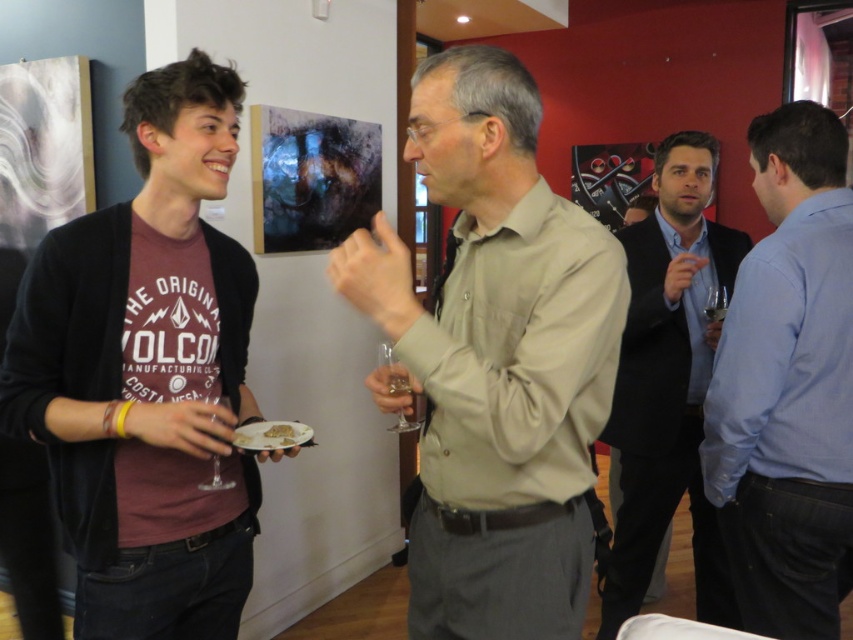
You are at an art exhibition and see two men in the foreground. One is wearing a matte khaki shirt at center and the other a blue shirt at right. Which man is shorter?

The matte khaki shirt at center is not as tall as blue shirt at right, so the man wearing the matte khaki shirt at center is shorter.

You are a photographer at the event and want to take a photo of the smooth black suit at right. Your camera has a minimum focus distance of 1.8 meters. Can you capture a clear photo without moving closer?

The smooth black suit at right is 2.03 meters away from the viewer, which is beyond the camera minimum focus distance of 1.8 meters. Therefore, you can capture a clear photo without moving closer.

You are at the art exhibition and want to approach the person wearing the matte khaki shirt at center. Based on their position, where should you walk towards?

The matte khaki shirt at center is located at coordinates point (x=496, y=358), so you should walk towards the center area of the image to reach them.